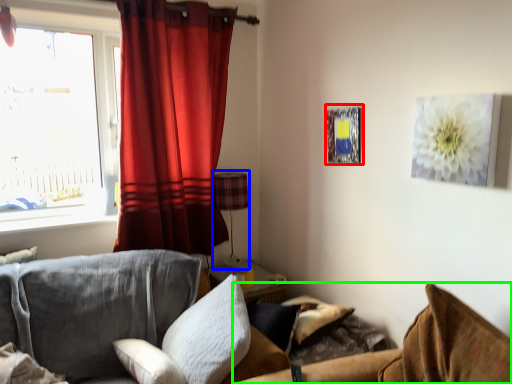
Question: Which is nearer to the picture frame (highlighted by a red box)? lamp (highlighted by a blue box) or couch (highlighted by a green box).

Choices:
 (A) lamp
 (B) couch

Answer: (A)